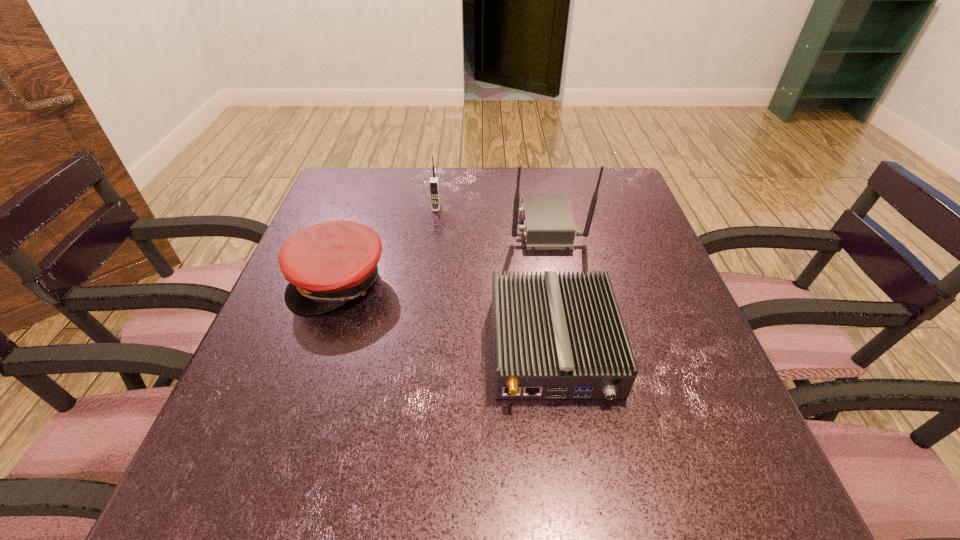
What are the coordinates of `the taller router` in the screenshot? It's located at (548, 222).

Locate an element on the screen. The image size is (960, 540). the tallest object is located at coordinates (548, 222).

Find the location of a particular element. This screenshot has width=960, height=540. the second object from left to right is located at coordinates (434, 180).

This screenshot has width=960, height=540. I want to click on cellular telephone, so click(x=434, y=180).

Find the location of a particular element. The image size is (960, 540). the leftmost object is located at coordinates (327, 265).

You are a GUI agent. You are given a task and a screenshot of the screen. Output one action in this format:
    pyautogui.click(x=<x>, y=<y>)
    Task: Click on the shorter router
    The width and height of the screenshot is (960, 540).
    Given the screenshot: What is the action you would take?
    pyautogui.click(x=555, y=336)

The image size is (960, 540). I want to click on the nearer router, so click(x=555, y=336).

The width and height of the screenshot is (960, 540). What are the coordinates of `free space located on the back of the tallest object to connect cables` in the screenshot? It's located at (398, 226).

Identify the location of vacant space located 0.070m on the back of the tallest object to connect cables. The height and width of the screenshot is (540, 960). (482, 226).

Locate an element on the screen. This screenshot has height=540, width=960. free space located on the back of the tallest object to connect cables is located at coordinates (391, 226).